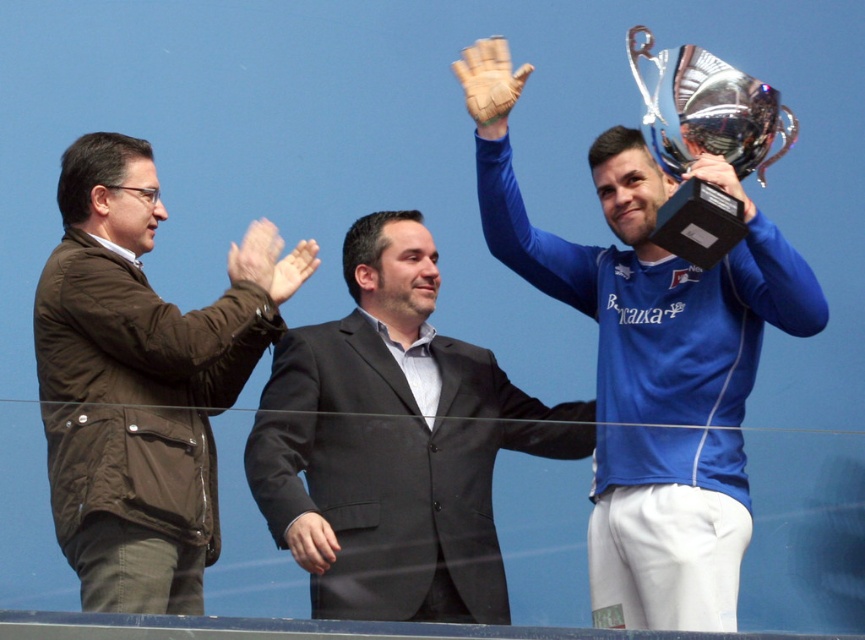
You are a photographer at the event and need to capture a photo that includes both the metallic trophy at upper right and the metallic silver trophy at upper right. Which trophy should you position to the left in your camera frame to ensure both are visible?

You should position the metallic trophy at upper right to the left in your camera frame because the metallic trophy at upper right is already on the left side of the metallic silver trophy at upper right.

You are taking a photo of two points in the scene. The first point is at coordinate point (481, 412) and the second point is at coordinate point (107, 240). Which point is closer to the camera?

Point (107, 240) is closer to the camera because it is less further than point (481, 412).